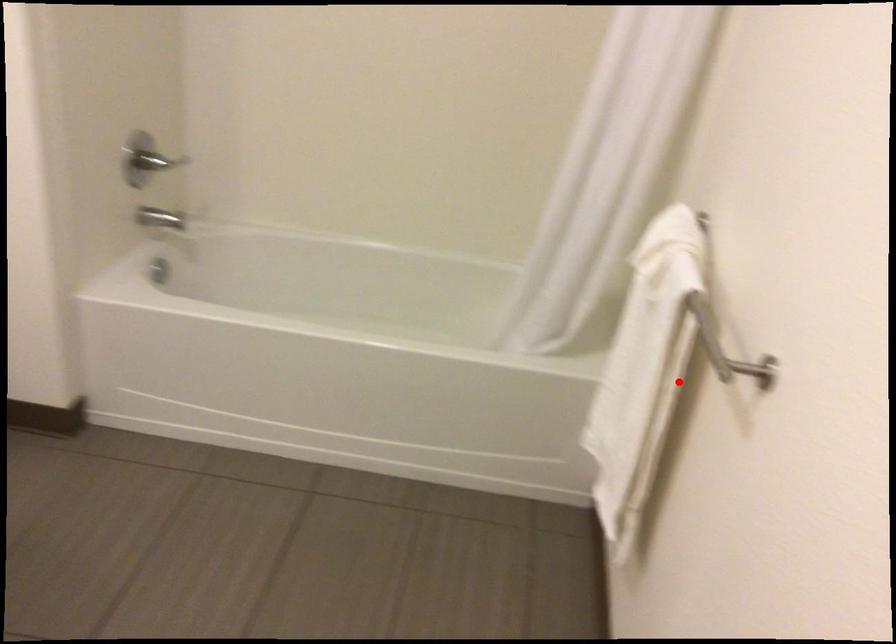
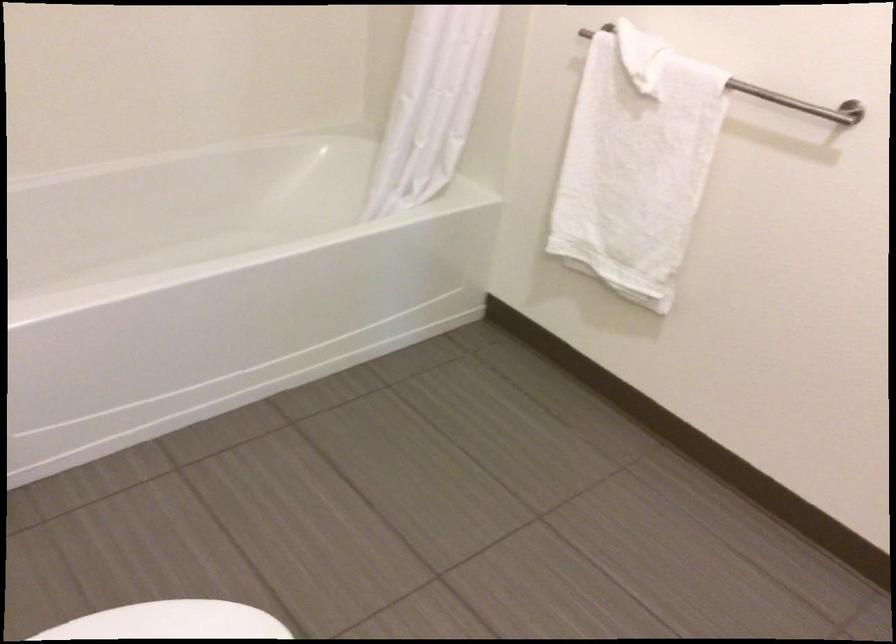
In the second image, find the point that corresponds to the highlighted location in the first image.

(634, 164)